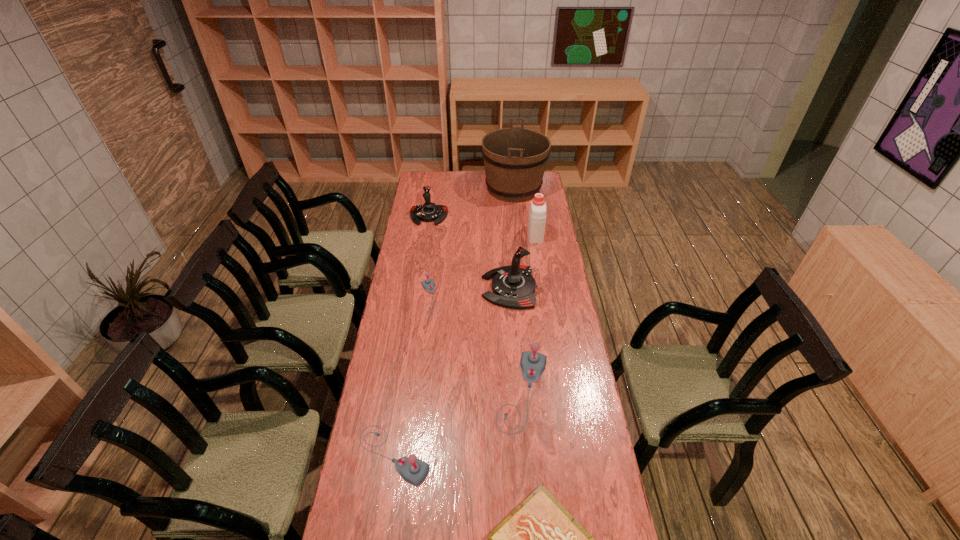
Locate an element on the screen. This screenshot has height=540, width=960. free space located on the handle side of the fourth shortest joystick is located at coordinates (422, 255).

At what (x,y) coordinates should I click in order to perform the action: click on free space located 0.120m on the left of the biggest gray joystick. Please return your answer as a coordinate pair (x, y). Looking at the image, I should click on (462, 392).

At what (x,y) coordinates should I click in order to perform the action: click on vacant region located on the back of the second biggest gray joystick. Please return your answer as a coordinate pair (x, y). Looking at the image, I should click on (402, 400).

The image size is (960, 540). In order to click on vacant space situated on the back of the farthest gray joystick in this screenshot , I will do `click(436, 251)`.

Identify the location of object positioned at the far edge. [515, 158].

At what (x,y) coordinates should I click in order to perform the action: click on bucket that is positioned at the right edge. Please return your answer as a coordinate pair (x, y). The width and height of the screenshot is (960, 540). Looking at the image, I should click on (515, 158).

Where is `detergent present at the right edge`? The height and width of the screenshot is (540, 960). detergent present at the right edge is located at coordinates (537, 215).

The image size is (960, 540). I want to click on object that is at the far right corner, so click(x=515, y=158).

Locate an element on the screen. Image resolution: width=960 pixels, height=540 pixels. vacant region at the far edge is located at coordinates (444, 186).

You are a GUI agent. You are given a task and a screenshot of the screen. Output one action in this format:
    pyautogui.click(x=<x>, y=<y>)
    Task: Click on the vacant space at the left edge of the desktop
    
    Given the screenshot: What is the action you would take?
    coord(376,427)